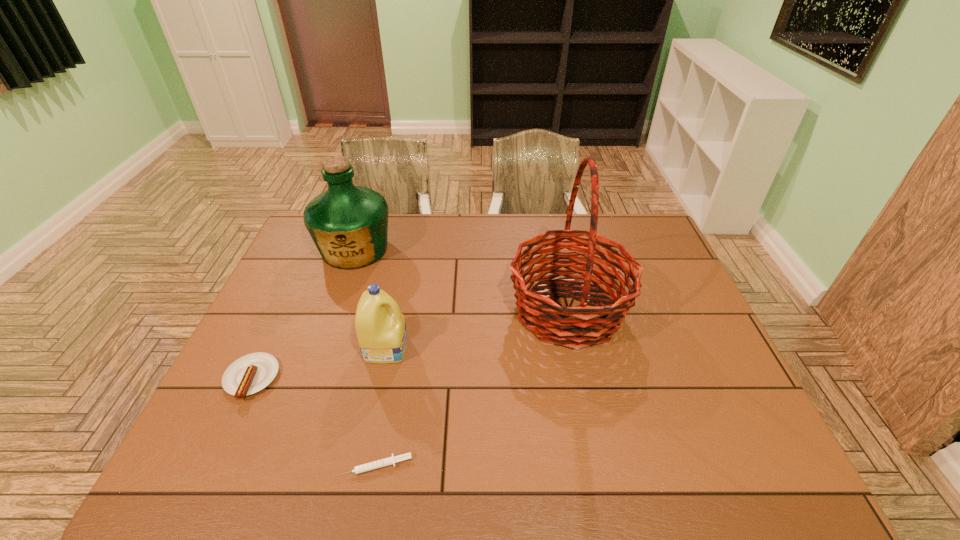
Find the location of a particular element. The width and height of the screenshot is (960, 540). free location located on the right of the sausage is located at coordinates (324, 379).

Find the location of a particular element. The width and height of the screenshot is (960, 540). vacant space located on the back of the syringe is located at coordinates (394, 361).

At what (x,y) coordinates should I click in order to perform the action: click on object present at the far edge. Please return your answer as a coordinate pair (x, y). The width and height of the screenshot is (960, 540). Looking at the image, I should click on (349, 224).

This screenshot has height=540, width=960. Identify the location of object located at the near edge. (388, 461).

Find the location of a particular element. The height and width of the screenshot is (540, 960). liquor that is at the left edge is located at coordinates (349, 224).

Where is `sausage that is at the left edge`? sausage that is at the left edge is located at coordinates (251, 373).

Where is `object located at the far left corner`? The image size is (960, 540). object located at the far left corner is located at coordinates (349, 224).

Locate an element on the screen. This screenshot has width=960, height=540. vacant region at the far edge is located at coordinates (538, 224).

Where is `vacant space at the near edge`? The height and width of the screenshot is (540, 960). vacant space at the near edge is located at coordinates (580, 451).

In order to click on free space at the left edge of the desktop in this screenshot , I will do `click(266, 339)`.